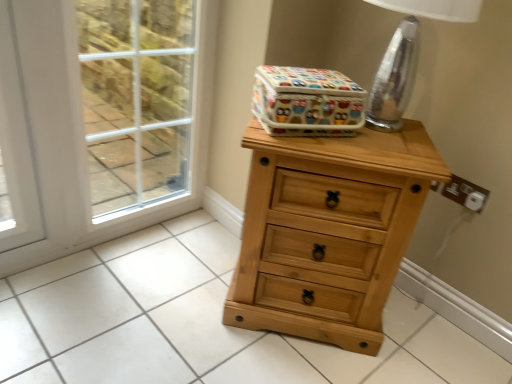
Question: From a real-world perspective, is natural wood chest of drawers at center physically located above or below white plastic electric outlet at right?

Choices:
 (A) above
 (B) below

Answer: (B)

Question: In the image, is natural wood chest of drawers at center on the left side or the right side of white plastic electric outlet at right?

Choices:
 (A) left
 (B) right

Answer: (A)

Question: Which is nearer to the clear glass table lamp at upper right?

Choices:
 (A) transparent glass screen door at left
 (B) white plastic electric outlet at right
 (C) natural wood chest of drawers at center
 (D) colorful fabric storage box at upper center

Answer: (D)

Question: Which object is the closest to the transparent glass screen door at left?

Choices:
 (A) natural wood chest of drawers at center
 (B) clear glass table lamp at upper right
 (C) white plastic electric outlet at right
 (D) colorful fabric storage box at upper center

Answer: (D)